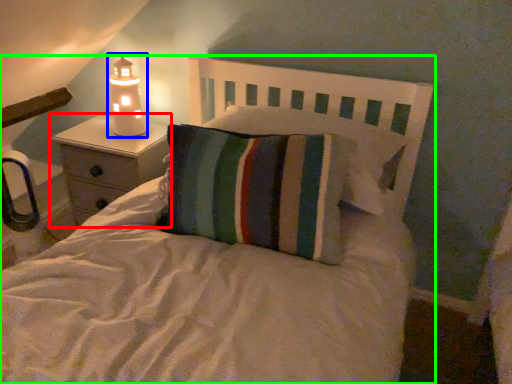
Question: Considering the real-world distances, which object is closest to nightstand (highlighted by a red box)? lamp (highlighted by a blue box) or bed (highlighted by a green box).

Choices:
 (A) lamp
 (B) bed

Answer: (A)